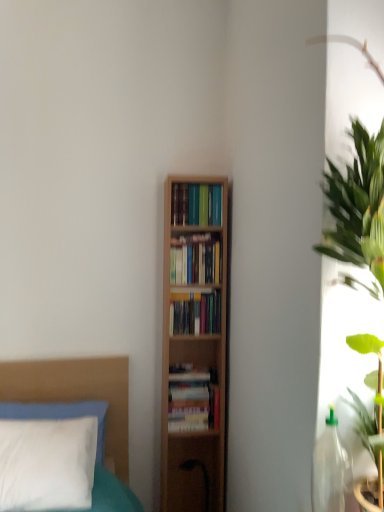
Identify the location of free spot below hardcover books at center, which appears as the 2th book when ordered from the bottom (from a real-world perspective). The height and width of the screenshot is (512, 384). (196, 371).